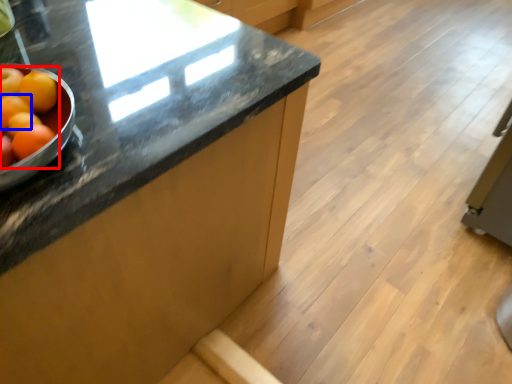
Question: Which object is closer to the camera taking this photo, grapefruit (highlighted by a red box) or orange (highlighted by a blue box)?

Choices:
 (A) grapefruit
 (B) orange

Answer: (A)